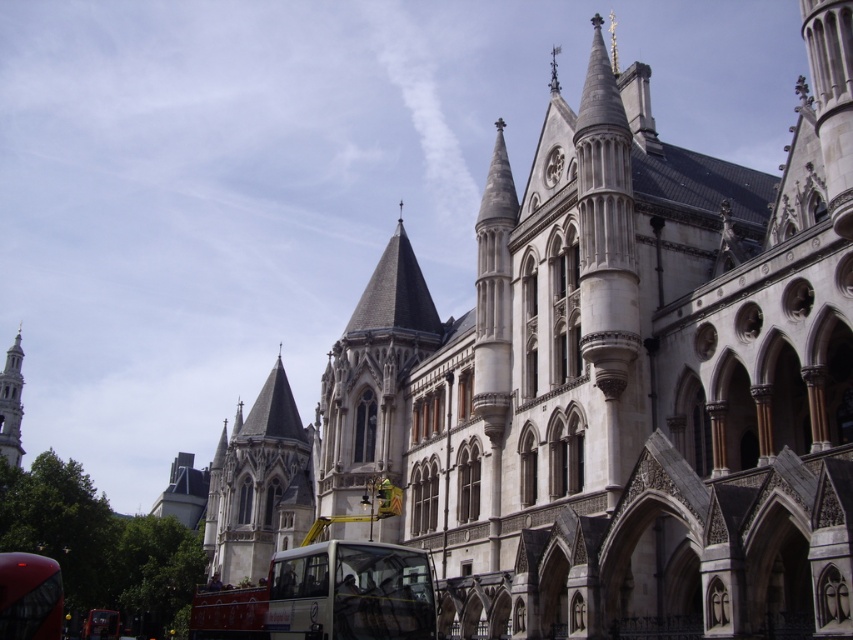
Does stone gothic tower at center-left appear on the left side of shiny red bus at lower left?

Indeed, stone gothic tower at center-left is positioned on the left side of shiny red bus at lower left.

Based on the photo, between stone gothic tower at center-left and shiny red bus at lower left, which one is positioned higher?

shiny red bus at lower left is above.

Which is in front, point (296, 509) or point (33, 632)?

Point (33, 632) is in front.

Where is `stone gothic tower at center-left`? stone gothic tower at center-left is located at coordinates (257, 484).

Does stone gothic tower at center-left appear on the right side of silver metallic spire at left?

Yes, stone gothic tower at center-left is to the right of silver metallic spire at left.

Between stone gothic tower at center-left and silver metallic spire at left, which one has less height?

stone gothic tower at center-left is shorter.

Who is more forward, (224, 545) or (9, 387)?

Positioned in front is point (224, 545).

This screenshot has height=640, width=853. Find the location of `stone gothic tower at center-left`. stone gothic tower at center-left is located at coordinates (257, 484).

Does shiny red bus at lower left appear on the right side of silver metallic spire at left?

Yes, shiny red bus at lower left is to the right of silver metallic spire at left.

Is shiny red bus at lower left wider than silver metallic spire at left?

In fact, shiny red bus at lower left might be narrower than silver metallic spire at left.

This screenshot has width=853, height=640. Find the location of `shiny red bus at lower left`. shiny red bus at lower left is located at coordinates (28, 596).